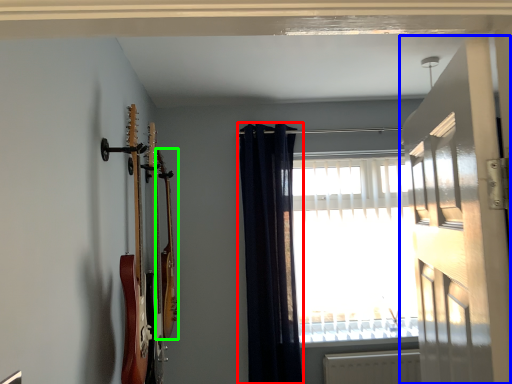
Question: Estimate the real-world distances between objects in this image. Which object is farther from curtain (highlighted by a red box), door (highlighted by a blue box) or guitar (highlighted by a green box)?

Choices:
 (A) door
 (B) guitar

Answer: (A)